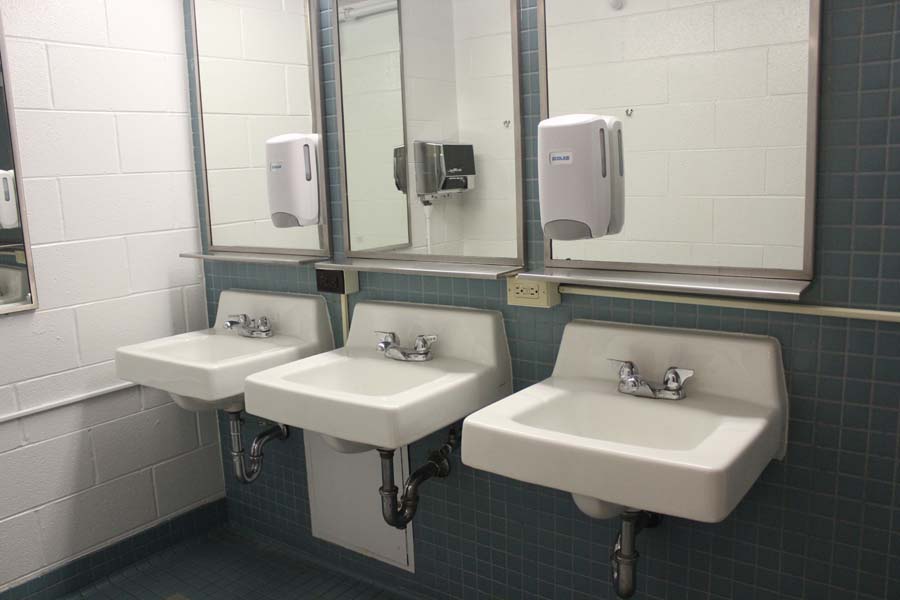
Where is `white tile wall`? white tile wall is located at coordinates (104, 250).